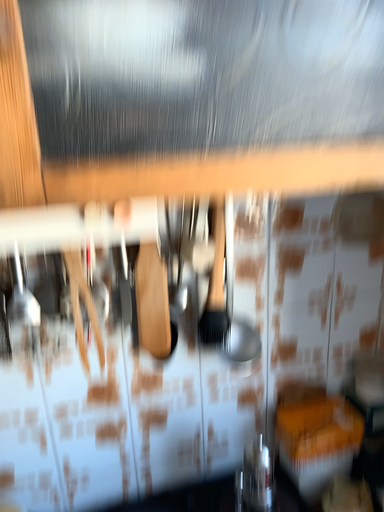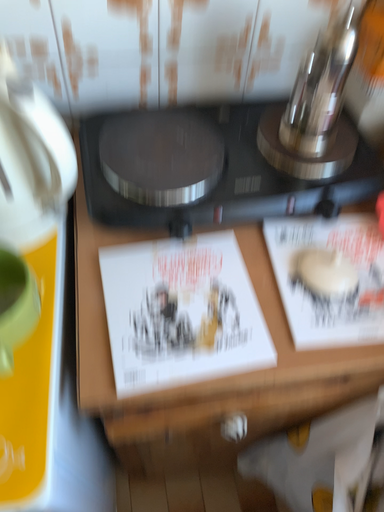
Question: How did the camera likely rotate when shooting the video?

Choices:
 (A) rotated upward
 (B) rotated downward

Answer: (B)